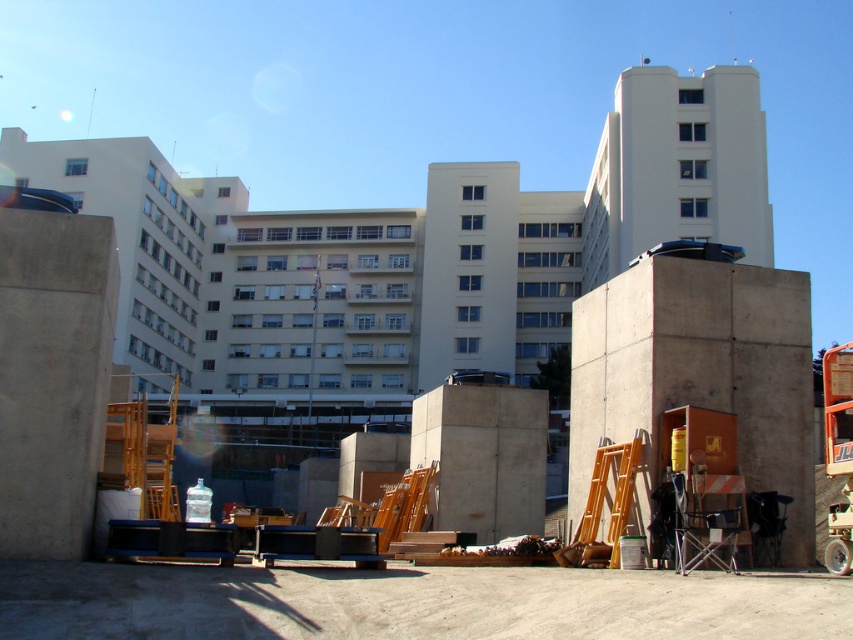
Question: Where is concrete rough at lower center located in relation to concreteroughblock at right in the image?

Choices:
 (A) right
 (B) left

Answer: (B)

Question: Which point is closer to the camera?

Choices:
 (A) concreteroughblock at right
 (B) concrete rough at lower center

Answer: (B)

Question: Is concrete rough at lower center bigger than concreteroughblock at right?

Choices:
 (A) yes
 (B) no

Answer: (A)

Question: Which object appears closest to the camera in this image?

Choices:
 (A) concrete rough at lower center
 (B) concreteroughblock at right

Answer: (A)

Question: Does concrete rough at lower center come in front of concreteroughblock at right?

Choices:
 (A) yes
 (B) no

Answer: (A)